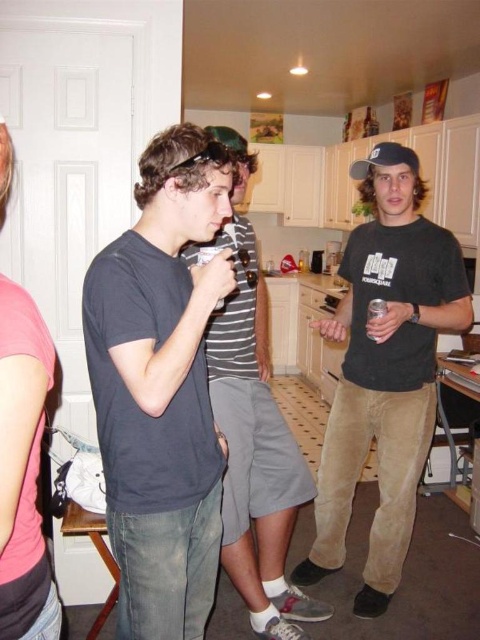
Question: Is matte black t-shirt at center positioned at the back of clear plastic cup at center right?

Choices:
 (A) yes
 (B) no

Answer: (B)

Question: Which object appears farthest from the camera in this image?

Choices:
 (A) matte black t-shirt at center
 (B) black suede t-shirt at center

Answer: (B)

Question: Among these points, which one is nearest to the camera?

Choices:
 (A) (135, 545)
 (B) (287, 538)
 (C) (363, 429)
 (D) (371, 336)

Answer: (A)

Question: Can you confirm if dark gray t-shirt at center is positioned above clear plastic cup at center right?

Choices:
 (A) no
 (B) yes

Answer: (A)

Question: Does dark gray t-shirt at center have a smaller size compared to matte black t-shirt at center?

Choices:
 (A) yes
 (B) no

Answer: (A)

Question: Which of the following is the closest to the observer?

Choices:
 (A) (248, 508)
 (B) (133, 326)

Answer: (B)